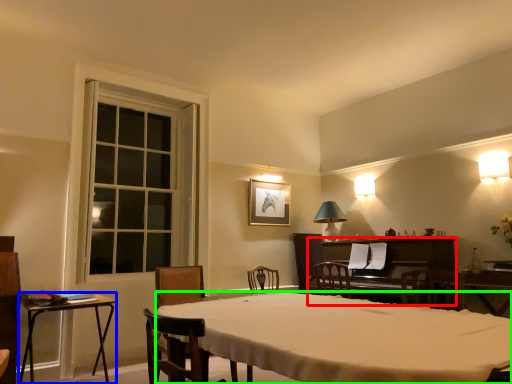
Question: Which object is positioned closest to piano (highlighted by a red box)? Select from table (highlighted by a blue box) and desk (highlighted by a green box).

Choices:
 (A) table
 (B) desk

Answer: (B)